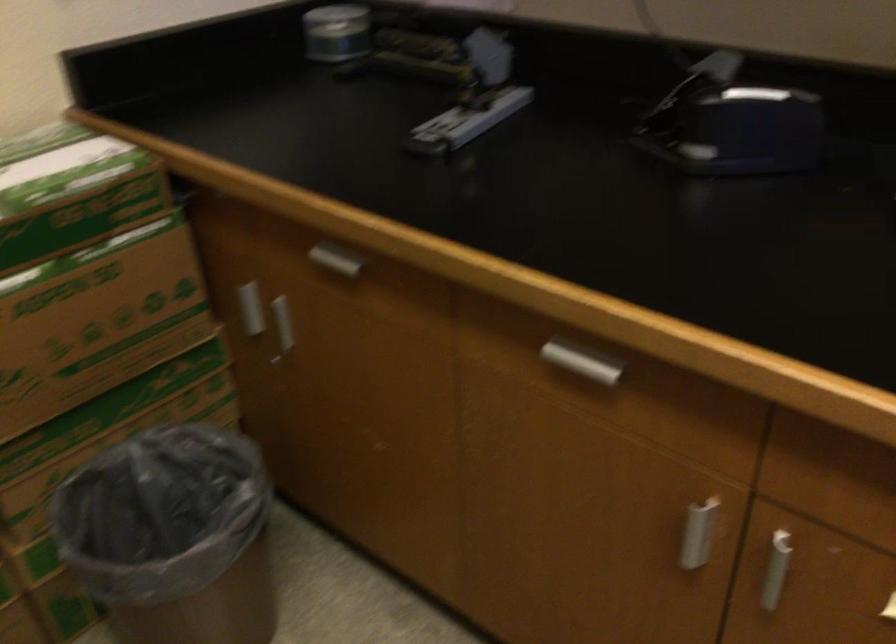
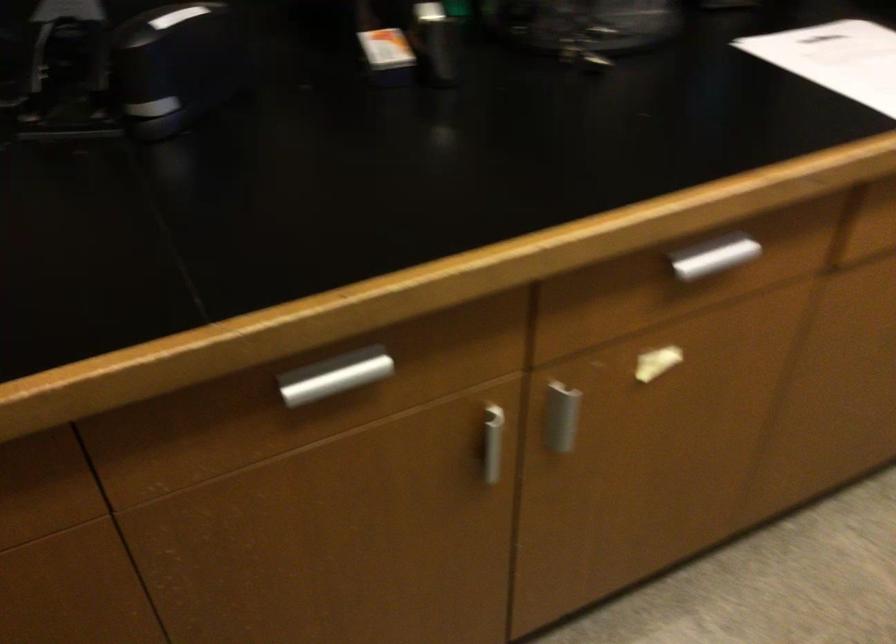
In the second image, find the point that corresponds to point 579,348 in the first image.

(317, 372)